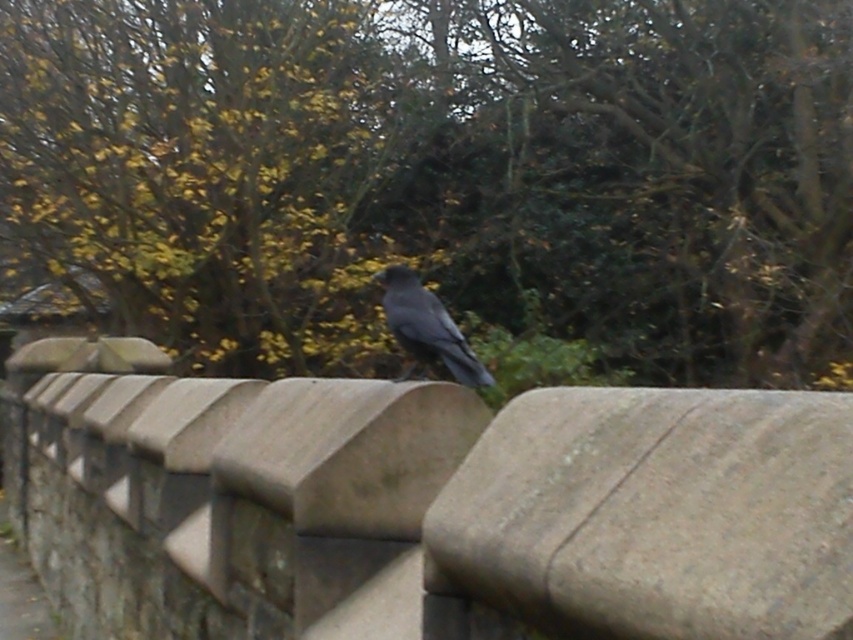
Question: Which of these objects is positioned farthest from the gray stone wall at center?

Choices:
 (A) shiny black bird at center
 (B) green leafy tree at upper center

Answer: (B)

Question: Considering the real-world distances, which object is farthest from the green leafy tree at upper center?

Choices:
 (A) shiny black bird at center
 (B) gray stone wall at center

Answer: (B)

Question: Does green leafy tree at upper center have a larger size compared to shiny black bird at center?

Choices:
 (A) yes
 (B) no

Answer: (B)

Question: Which point is farther to the camera?

Choices:
 (A) (332, 321)
 (B) (675, 448)
 (C) (469, 353)

Answer: (A)

Question: Does gray stone wall at center appear under shiny black bird at center?

Choices:
 (A) yes
 (B) no

Answer: (A)

Question: Does gray stone wall at center appear under shiny black bird at center?

Choices:
 (A) no
 (B) yes

Answer: (B)